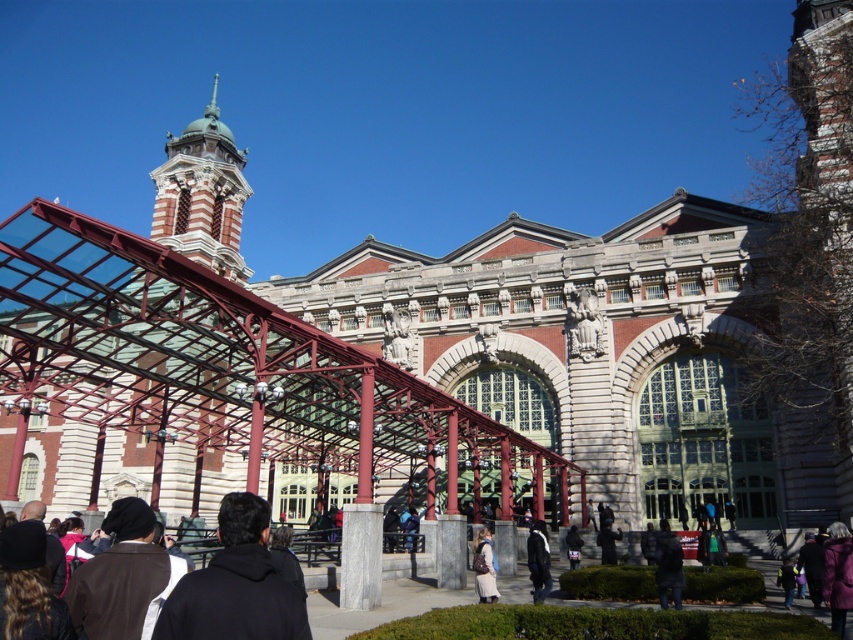
You are standing in front of the grand building and notice two dark gray jackets. One is the dark gray jacket at lower right, and the other is the dark gray fabric jacket at lower center. Which jacket is located to the right of the other?

The dark gray jacket at lower right is positioned on the right side of the dark gray fabric jacket at lower center.